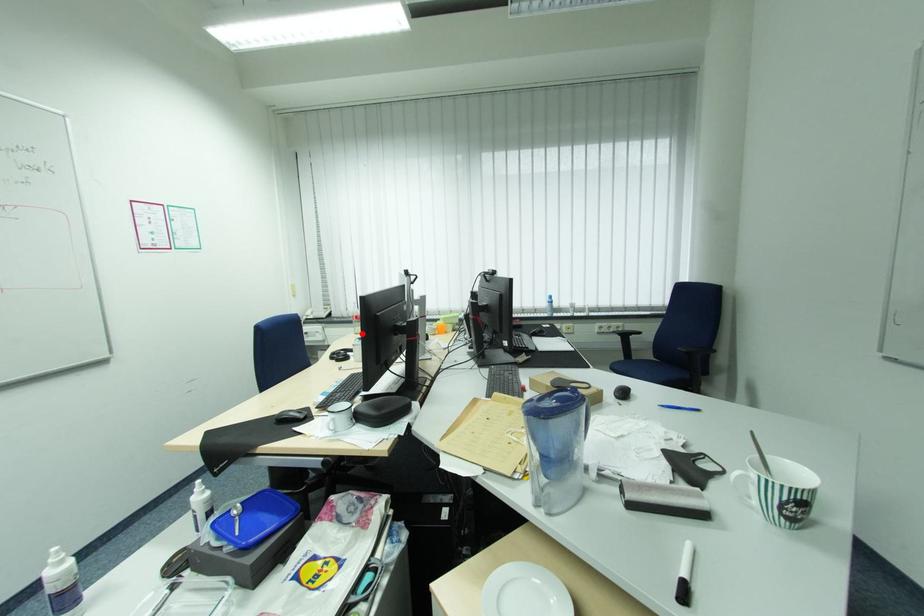
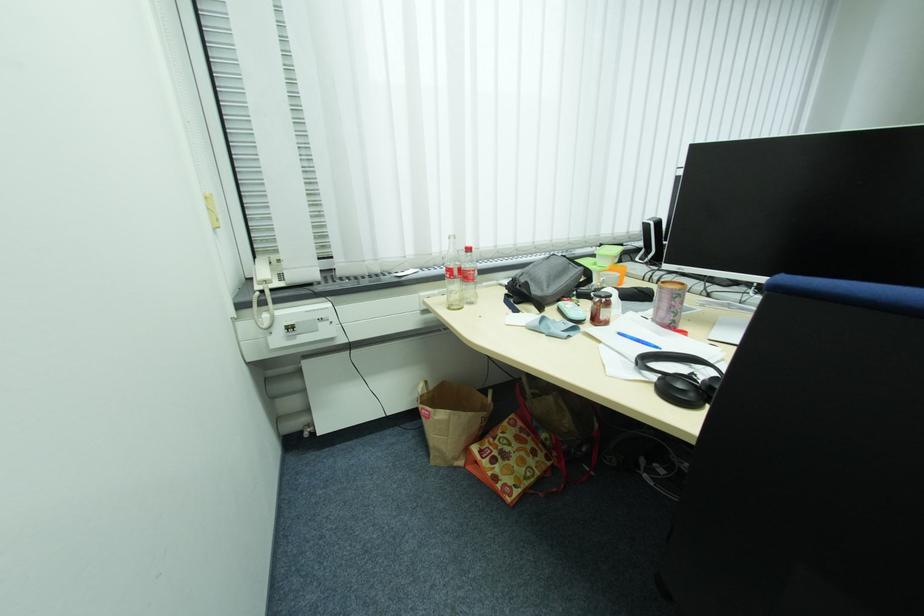
Question: I am providing you with two images of the same scene from different viewpoints. Image1 has a red point marked. In image2, the corresponding 3D location appears at what relative position? Reply with the corresponding letter.

Choices:
 (A) Closer
 (B) Farther

Answer: (A)